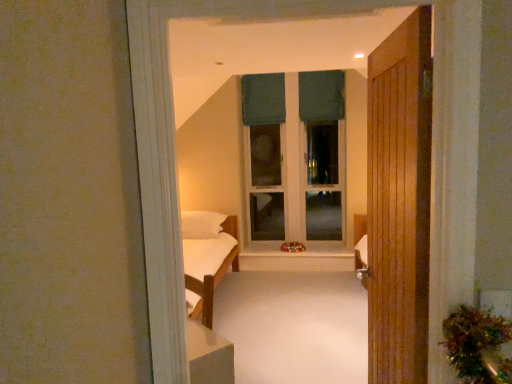
Question: From the image's perspective, would you say dark green fabric curtain at upper center, the second curtain in the right-to-left sequence, is positioned over white wood at center?

Choices:
 (A) yes
 (B) no

Answer: (A)

Question: Is dark green fabric curtain at upper center, placed as the first curtain when sorted from left to right, closer to camera compared to white wood at center?

Choices:
 (A) no
 (B) yes

Answer: (A)

Question: Is dark green fabric curtain at upper center, placed as the first curtain when sorted from left to right, bigger than white wood at center?

Choices:
 (A) no
 (B) yes

Answer: (B)

Question: Is dark green fabric curtain at upper center, the second curtain in the right-to-left sequence, located outside white wood at center?

Choices:
 (A) no
 (B) yes

Answer: (B)

Question: From a real-world perspective, does dark green fabric curtain at upper center, the second curtain in the right-to-left sequence, stand above white wood at center?

Choices:
 (A) yes
 (B) no

Answer: (A)

Question: Do you think dark green fabric curtain at upper center, the second curtain in the right-to-left sequence, is within wooden door at right, or outside of it?

Choices:
 (A) outside
 (B) inside

Answer: (A)

Question: Considering the positions of point click(262, 107) and point click(396, 175), is point click(262, 107) closer or farther from the camera than point click(396, 175)?

Choices:
 (A) farther
 (B) closer

Answer: (A)

Question: Visually, is dark green fabric curtain at upper center, the second curtain in the right-to-left sequence, positioned to the left or to the right of wooden door at right?

Choices:
 (A) left
 (B) right

Answer: (A)

Question: Considering the positions of dark green fabric curtain at upper center, the second curtain in the right-to-left sequence, and wooden door at right in the image, is dark green fabric curtain at upper center, the second curtain in the right-to-left sequence, taller or shorter than wooden door at right?

Choices:
 (A) short
 (B) tall

Answer: (A)

Question: Is point (394, 193) closer or farther from the camera than point (260, 117)?

Choices:
 (A) farther
 (B) closer

Answer: (B)

Question: In terms of width, does wooden door at right look wider or thinner when compared to dark green fabric curtain at upper center, placed as the first curtain when sorted from left to right?

Choices:
 (A) thin
 (B) wide

Answer: (B)

Question: Is wooden door at right bigger or smaller than dark green fabric curtain at upper center, placed as the first curtain when sorted from left to right?

Choices:
 (A) small
 (B) big

Answer: (B)

Question: Would you say wooden door at right is inside or outside dark green fabric curtain at upper center, placed as the first curtain when sorted from left to right?

Choices:
 (A) outside
 (B) inside

Answer: (A)

Question: Is dark green fabric at upper center, acting as the 1th curtain starting from the right, inside or outside of green fabric window frame at center?

Choices:
 (A) outside
 (B) inside

Answer: (B)

Question: From a real-world perspective, is dark green fabric at upper center, acting as the 1th curtain starting from the right, above or below green fabric window frame at center?

Choices:
 (A) below
 (B) above

Answer: (B)